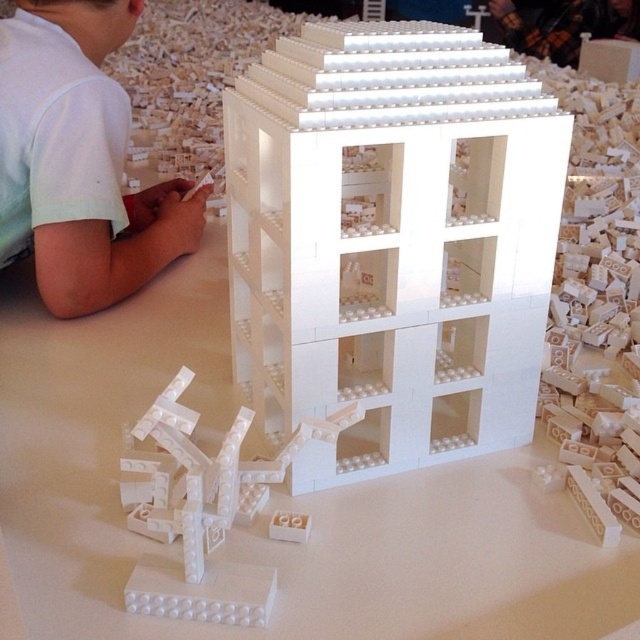
You are a visitor observing the child at the table. Which object, the white plastic building at center or the white matte shirt at upper left, would you say is bigger in size?

The white plastic building at center is larger in size than the white matte shirt at upper left.

You are a photographer trying to capture the white plastic building at center and the white matte shirt at upper left in the same frame. Which object will appear larger in the photo?

The white plastic building at center will appear larger in the photo because it is closer to the viewer than the white matte shirt at upper left.